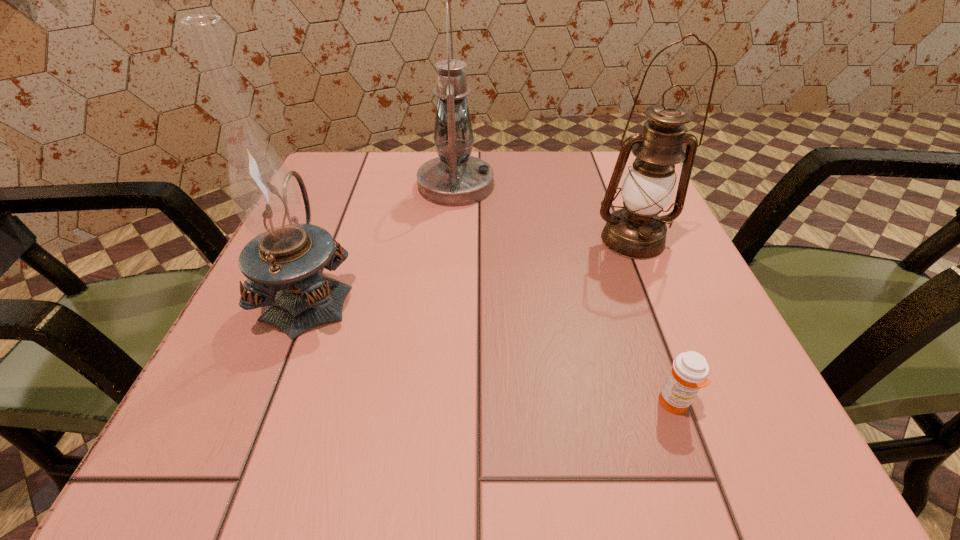
Image resolution: width=960 pixels, height=540 pixels. I want to click on vacant space that is in between the rightmost oil lamp and the leftmost oil lamp, so click(x=471, y=267).

This screenshot has height=540, width=960. I want to click on free spot between the rightmost oil lamp and the farthest object, so click(x=544, y=213).

I want to click on unoccupied position between the leftmost oil lamp and the medicine, so click(492, 349).

You are a GUI agent. You are given a task and a screenshot of the screen. Output one action in this format:
    pyautogui.click(x=<x>, y=<y>)
    Task: Click on the vacant space in between the second object from left to right and the leftmost oil lamp
    This screenshot has width=960, height=540.
    Given the screenshot: What is the action you would take?
    pyautogui.click(x=383, y=240)

I want to click on object that is the second closest to the rightmost oil lamp, so click(x=689, y=372).

Identify the location of object that can be found as the second closest to the rightmost oil lamp. (689, 372).

You are a GUI agent. You are given a task and a screenshot of the screen. Output one action in this format:
    pyautogui.click(x=<x>, y=<y>)
    Task: Click on the closest oil lamp relative to the medicine
    Image resolution: width=960 pixels, height=540 pixels.
    Given the screenshot: What is the action you would take?
    pyautogui.click(x=636, y=231)

Select which oil lamp is the closest to the farthest object. Please provide its 2D coordinates. Your answer should be formatted as a tuple, i.e. [(x, y)], where the tuple contains the x and y coordinates of a point satisfying the conditions above.

[(282, 262)]

The height and width of the screenshot is (540, 960). Find the location of `free space in the image that satisfies the following two spatial constraints: 1. on the back side of the rightmost oil lamp; 2. on the left side of the shortest object`. free space in the image that satisfies the following two spatial constraints: 1. on the back side of the rightmost oil lamp; 2. on the left side of the shortest object is located at coordinates (615, 240).

Find the location of a particular element. vacant region that satisfies the following two spatial constraints: 1. on the front side of the leftmost oil lamp; 2. on the left side of the nearest object is located at coordinates (268, 403).